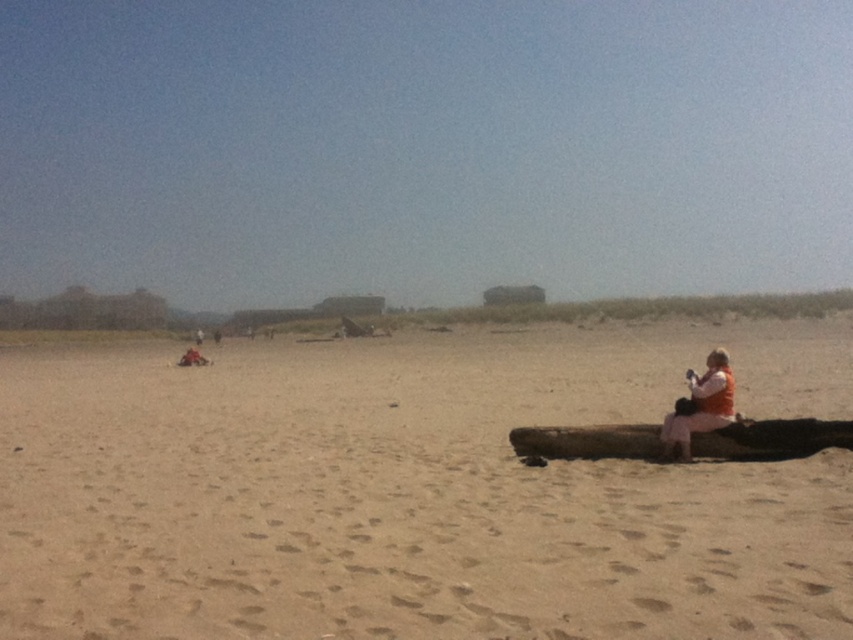
The height and width of the screenshot is (640, 853). Describe the element at coordinates (415, 492) in the screenshot. I see `smooth sand at lower right` at that location.

Is smooth sand at lower right to the right of brown wood log at lower right from the viewer's perspective?

In fact, smooth sand at lower right is to the left of brown wood log at lower right.

At what (x,y) coordinates should I click in order to perform the action: click on smooth sand at lower right. Please return your answer as a coordinate pair (x, y). This screenshot has height=640, width=853. Looking at the image, I should click on (415, 492).

At what (x,y) coordinates should I click in order to perform the action: click on smooth sand at lower right. Please return your answer as a coordinate pair (x, y). The width and height of the screenshot is (853, 640). Looking at the image, I should click on (415, 492).